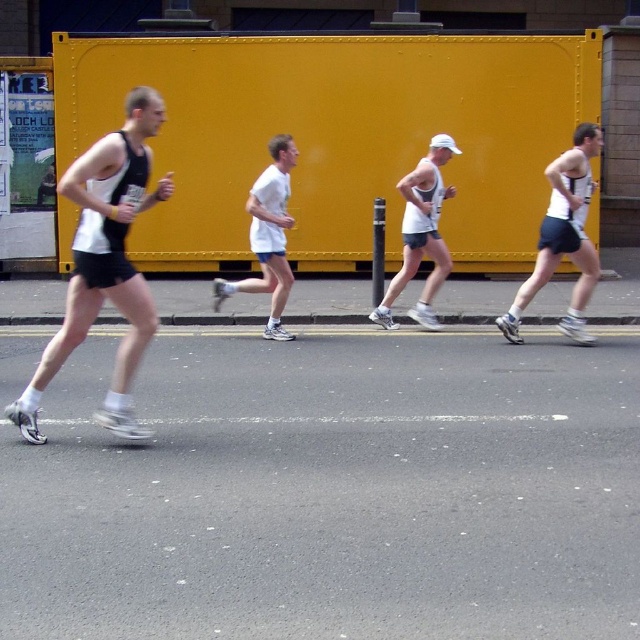
Based on the scene, which object is wider, the white matte singlet at left or the white matte shirt at center?

The white matte singlet at left is wider than the white matte shirt at center according to the description.

You are a photographer trying to capture a clear shot of the white matte shirt at center and the white matte tank top at center. Since both are in the same general area, which one is more likely to be obscured by the other in your photo?

The white matte shirt at center is behind the white matte tank top at center, so it is more likely to be obscured in the photo.

You are a photographer trying to capture the runners. You notice the white matte shorts at right and the white matte tank top at center. Which clothing item appears wider in the photo?

The white matte shorts at right appears wider than the white matte tank top at center because the white matte shorts at right has a larger width according to the description.